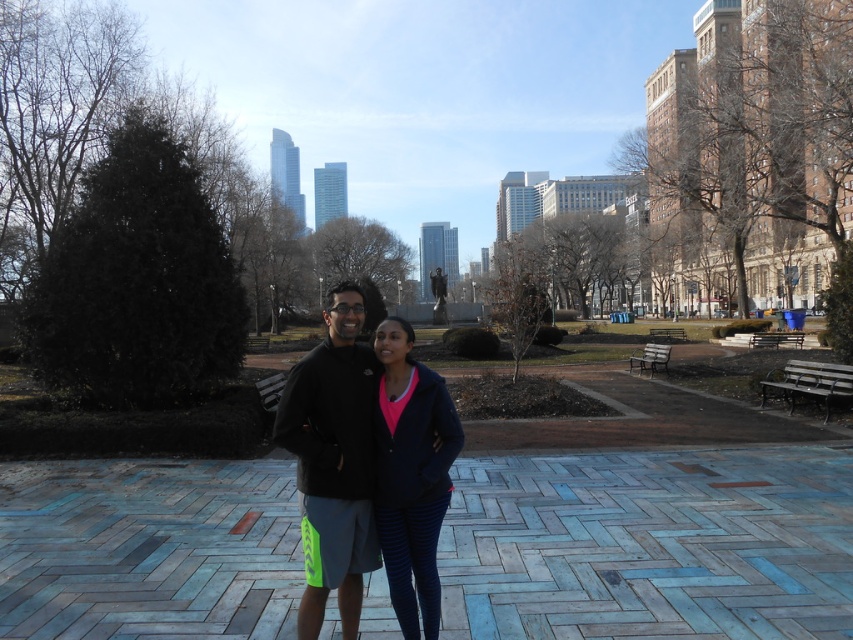
Between dark blue fleece at center and matte blue leggings at center, which one appears on the right side from the viewer's perspective?

→ matte blue leggings at center

Who is more distant from viewer, [300,376] or [413,586]?

A: Positioned behind is point [413,586].

Find the location of `dark blue fleece at center`. dark blue fleece at center is located at coordinates (334, 458).